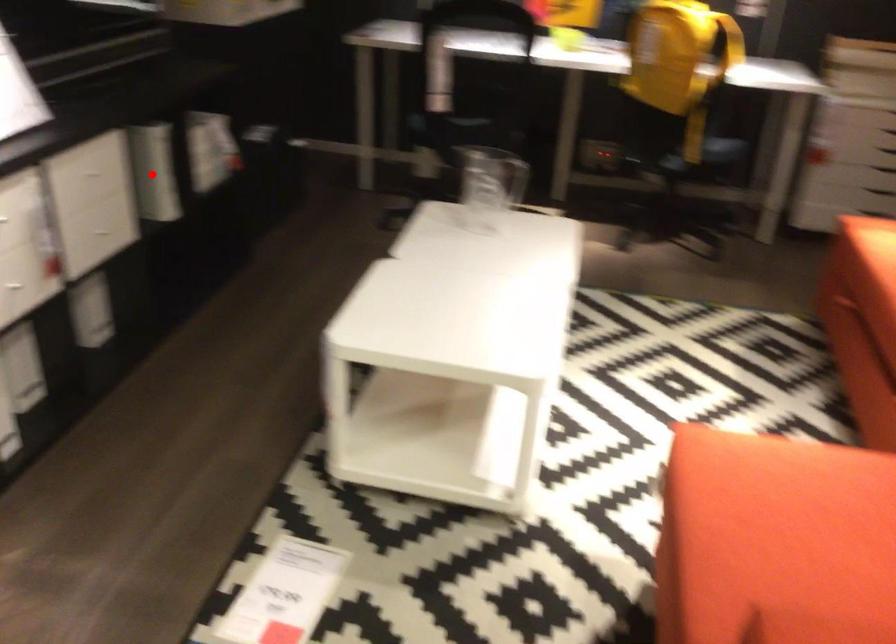
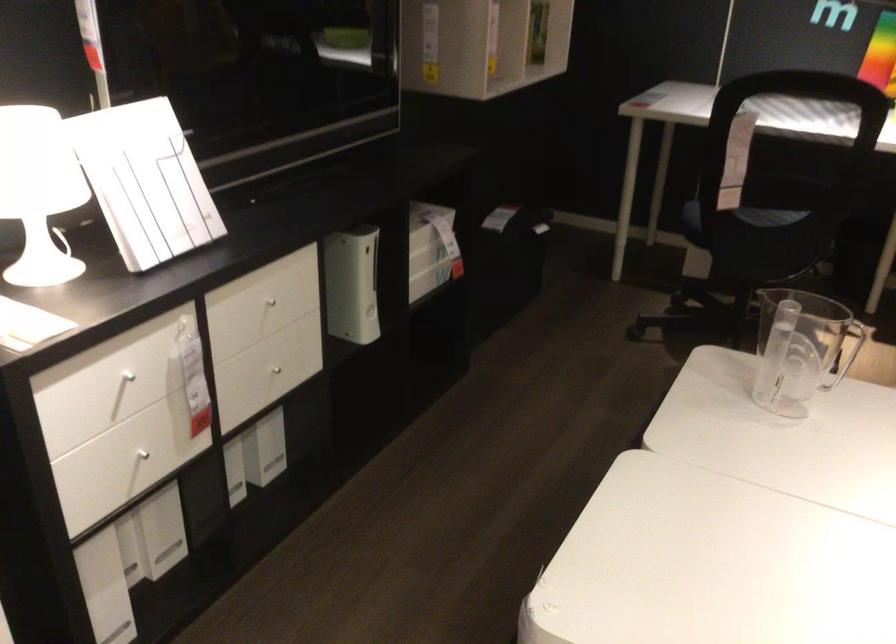
In the second image, find the point that corresponds to the highlighted location in the first image.

(351, 285)